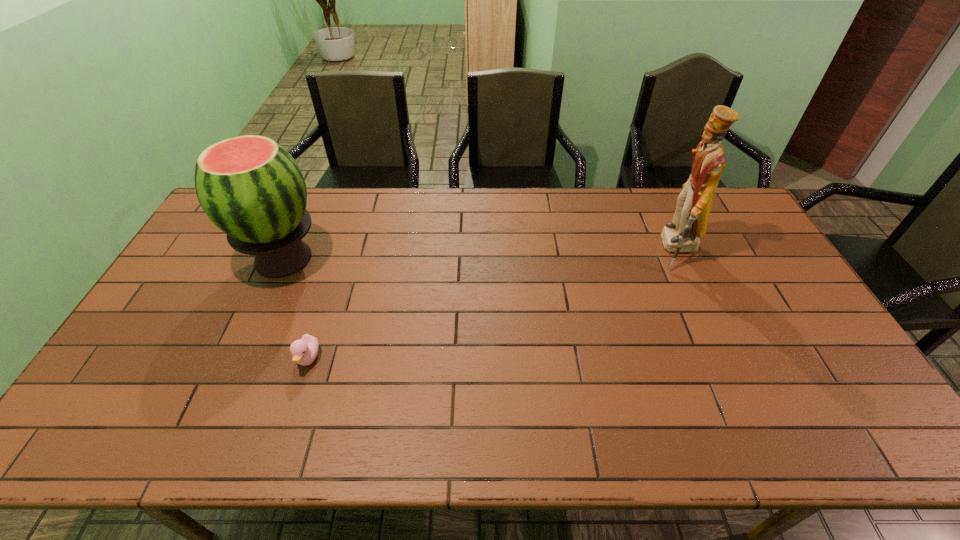
I want to click on vacant area situated 0.070m on the front-facing side of the duckling, so click(296, 399).

Image resolution: width=960 pixels, height=540 pixels. In the image, there is a desktop. In order to click on vacant space at the far edge in this screenshot , I will do `click(430, 215)`.

Where is `vacant space at the near edge of the desktop`? vacant space at the near edge of the desktop is located at coordinates (272, 447).

At what (x,y) coordinates should I click in order to perform the action: click on vacant space at the right edge of the desktop. Please return your answer as a coordinate pair (x, y). The height and width of the screenshot is (540, 960). Looking at the image, I should click on (723, 258).

Find the location of a particular element. The height and width of the screenshot is (540, 960). vacant region at the near right corner of the desktop is located at coordinates (873, 421).

Locate an element on the screen. This screenshot has height=540, width=960. free point between the second object from left to right and the second tallest object is located at coordinates (296, 309).

Where is `free space between the nutcracker and the second object from right to left`? The image size is (960, 540). free space between the nutcracker and the second object from right to left is located at coordinates (492, 304).

In order to click on free space between the tallest object and the shortest object in this screenshot , I will do 492,304.

Locate an element on the screen. The width and height of the screenshot is (960, 540). free spot between the tallest object and the leftmost object is located at coordinates (480, 254).

Image resolution: width=960 pixels, height=540 pixels. I want to click on vacant space that is in between the watermelon and the second object from right to left, so click(296, 309).